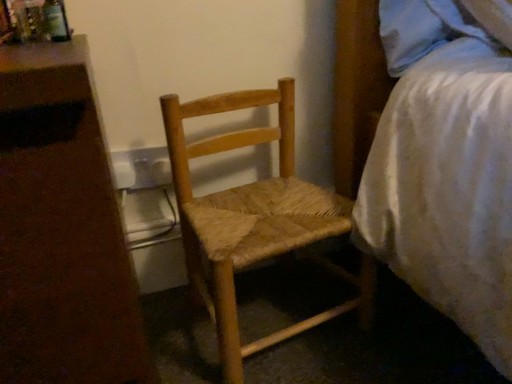
Question: Does natural wood woven chair at center come behind white textured bed at right?

Choices:
 (A) no
 (B) yes

Answer: (B)

Question: Is natural wood woven chair at center oriented towards white textured bed at right?

Choices:
 (A) no
 (B) yes

Answer: (A)

Question: Is natural wood woven chair at center to the left of white textured bed at right from the viewer's perspective?

Choices:
 (A) no
 (B) yes

Answer: (B)

Question: Would you say natural wood woven chair at center is a long distance from white textured bed at right?

Choices:
 (A) yes
 (B) no

Answer: (B)

Question: Can you confirm if natural wood woven chair at center is positioned to the right of white textured bed at right?

Choices:
 (A) yes
 (B) no

Answer: (B)

Question: Can we say natural wood woven chair at center lies outside white textured bed at right?

Choices:
 (A) no
 (B) yes

Answer: (B)

Question: Is natural wood woven chair at center bigger than white plastic nightstand at left?

Choices:
 (A) no
 (B) yes

Answer: (A)

Question: Is natural wood woven chair at center not within white plastic nightstand at left?

Choices:
 (A) yes
 (B) no

Answer: (A)

Question: From the image's perspective, would you say natural wood woven chair at center is positioned over white plastic nightstand at left?

Choices:
 (A) no
 (B) yes

Answer: (B)

Question: Are natural wood woven chair at center and white plastic nightstand at left beside each other?

Choices:
 (A) yes
 (B) no

Answer: (B)

Question: Is natural wood woven chair at center behind white plastic nightstand at left?

Choices:
 (A) no
 (B) yes

Answer: (B)

Question: Is natural wood woven chair at center looking in the opposite direction of white plastic nightstand at left?

Choices:
 (A) yes
 (B) no

Answer: (B)

Question: From a real-world perspective, does white plastic nightstand at left sit lower than natural wood woven chair at center?

Choices:
 (A) no
 (B) yes

Answer: (A)